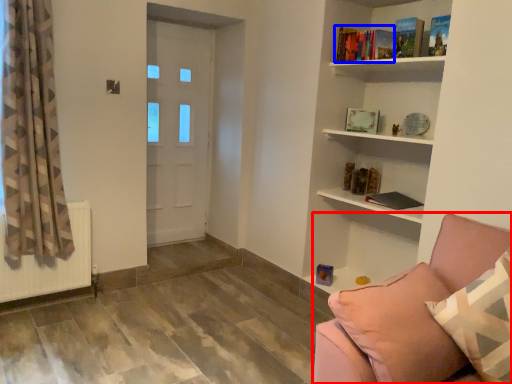
Question: Which point is closer to the camera, studio couch (highlighted by a red box) or book (highlighted by a blue box)?

Choices:
 (A) studio couch
 (B) book

Answer: (A)